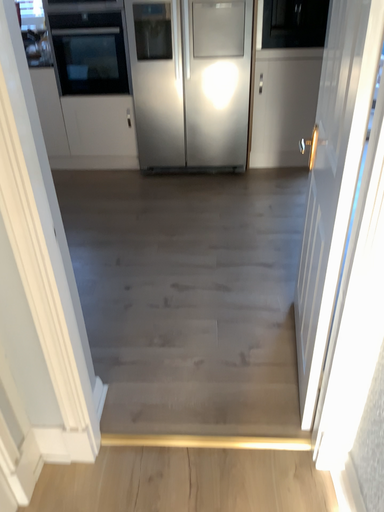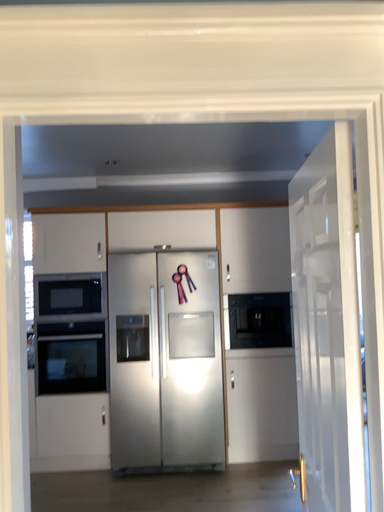
Question: How did the camera likely rotate when shooting the video?

Choices:
 (A) rotated upward
 (B) rotated downward

Answer: (A)